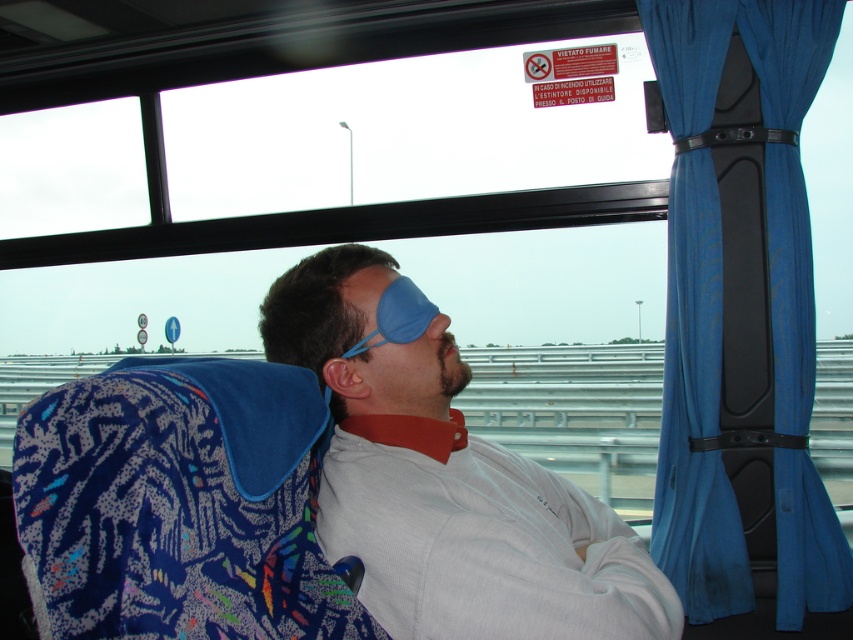
Between blue matte eye mask at center and blue matte eye mask at upper center, which one is positioned lower?

blue matte eye mask at center is below.

Is point (358, 252) more distant than point (438, 310)?

Yes, point (358, 252) is farther from viewer.

Locate an element on the screen. blue matte eye mask at center is located at coordinates (445, 477).

Between blue fabric curtain at right and blue matte eye mask at upper center, which one appears on the right side from the viewer's perspective?

blue fabric curtain at right is more to the right.

Does blue fabric curtain at right have a lesser width compared to blue matte eye mask at upper center?

No, blue fabric curtain at right is not thinner than blue matte eye mask at upper center.

Where is `blue fabric curtain at right`? The width and height of the screenshot is (853, 640). blue fabric curtain at right is located at coordinates (695, 410).

Can you confirm if blue matte eye mask at center is wider than blue fabric curtain at right?

Yes, blue matte eye mask at center is wider than blue fabric curtain at right.

Does blue matte eye mask at center have a smaller size compared to blue fabric curtain at right?

No.

Find the location of `blue matte eye mask at center`. blue matte eye mask at center is located at coordinates (445, 477).

You are a GUI agent. You are given a task and a screenshot of the screen. Output one action in this format:
    pyautogui.click(x=<x>, y=<y>)
    Task: Click on the blue matte eye mask at center
    The height and width of the screenshot is (640, 853).
    Given the screenshot: What is the action you would take?
    pyautogui.click(x=445, y=477)